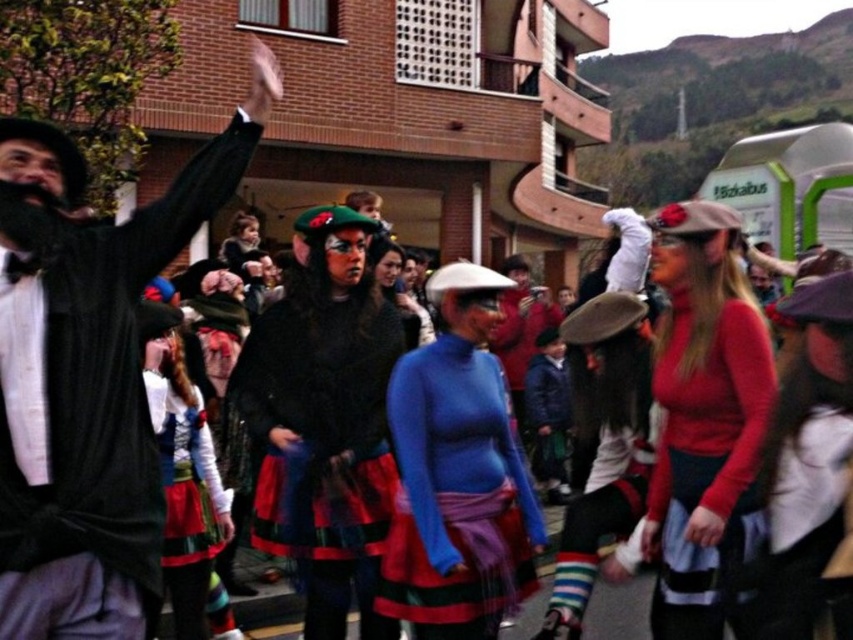
You are a photographer at this event and want to capture a photo that includes both the matte black coat at left and the multicolored fabric skirt at center. Based on their positions, which object should be placed on the left side of the photo to maintain their actual spatial arrangement?

The matte black coat at left should be placed on the left side of the photo since it is already positioned to the left of the multicolored fabric skirt at center in the scene.

You are a photographer at the event and want to ensure both the velvet black dress at center and the red matte sweater at center are visible in your photo. Given their sizes, which one might you need to position closer to the camera to ensure it stands out more?

The velvet black dress at center has a lesser height compared to the red matte sweater at center. To make the velvet black dress at center stand out more, you should position it closer to the camera since it is smaller in height and would appear larger in the photo when nearer.